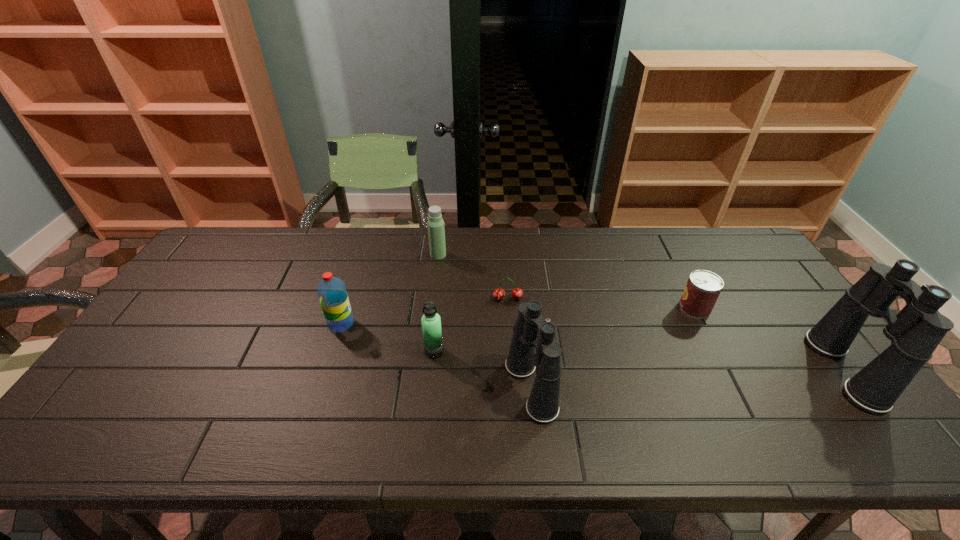
At what (x,y) coordinates should I click in order to perform the action: click on vacant area that lies between the tallest object and the farthest object. Please return your answer as a coordinate pair (x, y). Looking at the image, I should click on (641, 313).

Image resolution: width=960 pixels, height=540 pixels. I want to click on free space that is in between the leftmost object and the farthest object, so click(x=390, y=289).

Locate an element on the screen. object identified as the second closest to the shortest object is located at coordinates tap(431, 322).

Where is `object that stands as the closest to the right binoculars`? The image size is (960, 540). object that stands as the closest to the right binoculars is located at coordinates (703, 287).

Find the location of a particular element. This screenshot has height=540, width=960. blank space that satisfies the following two spatial constraints: 1. on the front label of the leftmost object; 2. on the left side of the second tallest object is located at coordinates (321, 388).

The image size is (960, 540). I want to click on free location that satisfies the following two spatial constraints: 1. on the back side of the sixth tallest object; 2. on the left side of the nearer thermos bottle, so click(439, 308).

Locate an element on the screen. vacant point that satisfies the following two spatial constraints: 1. on the front label of the water bottle; 2. on the left side of the left binoculars is located at coordinates (321, 388).

You are a GUI agent. You are given a task and a screenshot of the screen. Output one action in this format:
    pyautogui.click(x=<x>, y=<y>)
    Task: Click on the free location that satisfies the following two spatial constraints: 1. with stems pointing upwards on the shortest object; 2. on the front label of the leftmost object
    Image resolution: width=960 pixels, height=540 pixels.
    Given the screenshot: What is the action you would take?
    pyautogui.click(x=510, y=324)

Locate an element on the screen. The width and height of the screenshot is (960, 540). vacant space that satisfies the following two spatial constraints: 1. with stems pointing upwards on the sixth tallest object; 2. on the right side of the cherry is located at coordinates (509, 308).

I want to click on vacant region that satisfies the following two spatial constraints: 1. on the front side of the farther thermos bottle; 2. on the right side of the can, so click(x=432, y=308).